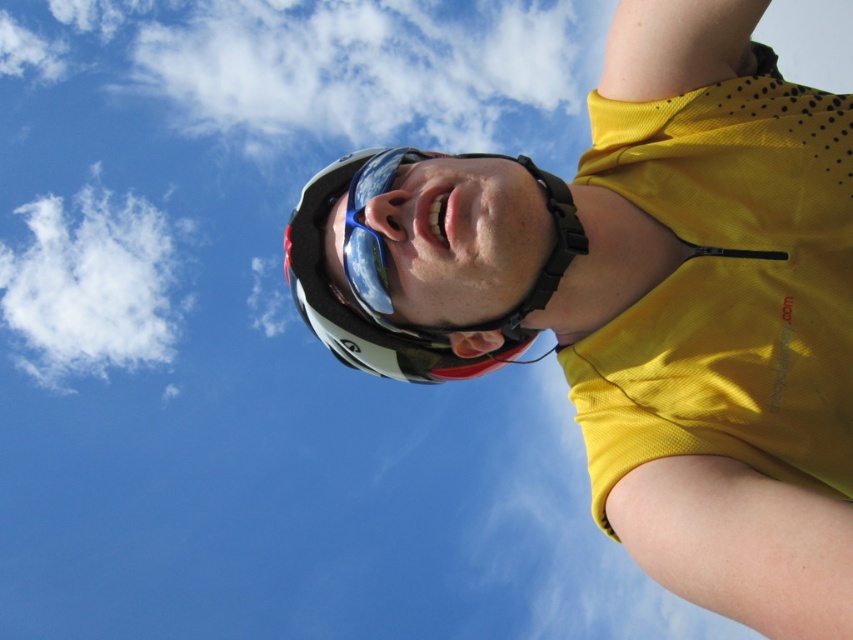
You are taking a photo of the person wearing the white matte helmet at upper center and the white fluffy cloud at upper left. Which object appears smaller in the photo?

The white matte helmet at upper center appears smaller in the photo compared to the white fluffy cloud at upper left because it has a smaller size.

You are a photographer trying to capture the white matte helmet at upper center and the white fluffy cloud at upper left in the same frame. Based on their sizes, which object would appear smaller in the photo?

The white matte helmet at upper center would appear smaller in the photo because its width is less than the white fluffy cloud at upper left.